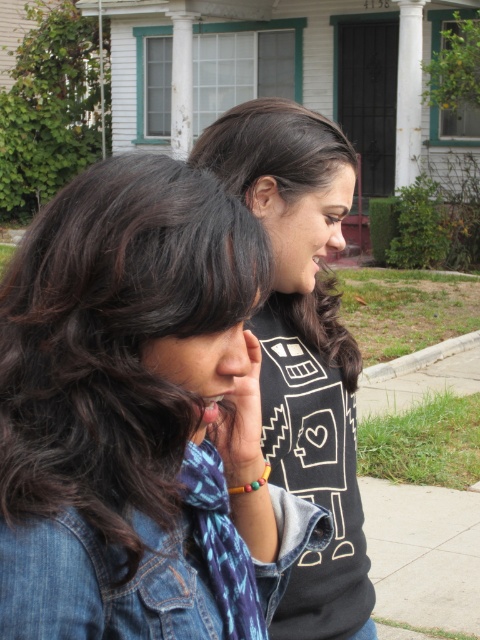
Where is the denim jacket at center located in the image?

The denim jacket at center is located at point (140, 417).

You are a delivery person trying to determine if the black matte sweatshirt at center is positioned higher than the matte black hand at center in the image. Based on the scene, can you confirm this?

The black matte sweatshirt at center is taller than the matte black hand at center, so yes, the sweatshirt is positioned higher than the hand in the image.